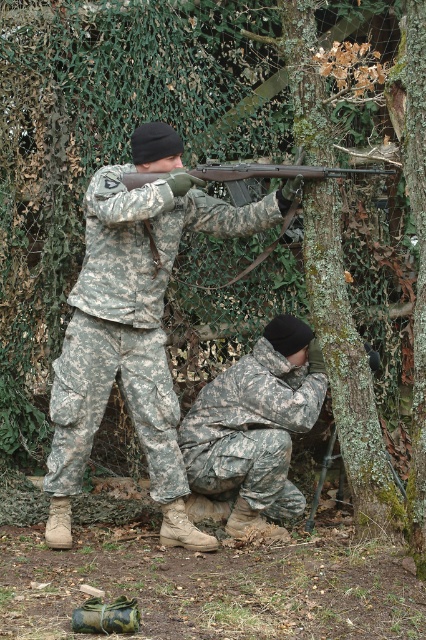
Question: Considering the real-world distances, which object is farthest from the matte black shotgun at center?

Choices:
 (A) camouflage fabric uniform at lower center
 (B) camouflage fabric uniform at upper center

Answer: (A)

Question: Does camouflage fabric uniform at lower center appear over matte black shotgun at center?

Choices:
 (A) yes
 (B) no

Answer: (B)

Question: Does camouflage fabric uniform at upper center appear on the left side of camouflage fabric uniform at lower center?

Choices:
 (A) no
 (B) yes

Answer: (B)

Question: Which object is the farthest from the matte black shotgun at center?

Choices:
 (A) camouflage fabric uniform at lower center
 (B) camouflage fabric uniform at upper center

Answer: (A)

Question: Does camouflage fabric uniform at upper center appear under camouflage fabric uniform at lower center?

Choices:
 (A) yes
 (B) no

Answer: (B)

Question: Which is nearer to the camouflage fabric uniform at upper center?

Choices:
 (A) matte black shotgun at center
 (B) camouflage fabric uniform at lower center

Answer: (B)